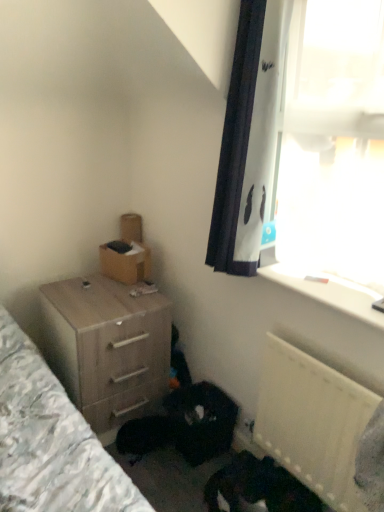
Question: Looking at the image, does wooden chest of drawers at lower left seem bigger or smaller compared to white plastic window sill at upper right?

Choices:
 (A) small
 (B) big

Answer: (B)

Question: Would you say wooden chest of drawers at lower left is to the left or to the right of white plastic window sill at upper right in the picture?

Choices:
 (A) left
 (B) right

Answer: (A)

Question: Which is farther from the white plastic radiator at lower right?

Choices:
 (A) brown cardboard box at upper left
 (B) dark fur cat at lower center
 (C) wooden chest of drawers at lower left
 (D) white plastic window sill at upper right

Answer: (A)

Question: Estimate the real-world distances between objects in this image. Which object is farther from the wooden chest of drawers at lower left?

Choices:
 (A) brown cardboard box at upper left
 (B) dark fur cat at lower center
 (C) white plastic window sill at upper right
 (D) white plastic radiator at lower right

Answer: (C)